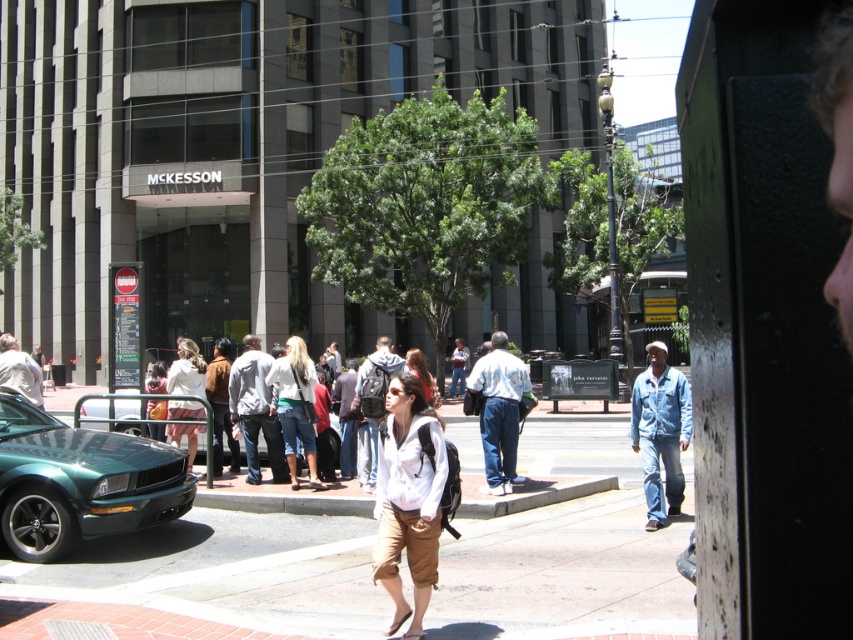
Question: Which object is the closest to the gray cotton hoodie at center?

Choices:
 (A) khaki cotton shorts at center
 (B) matte white shirt at center

Answer: (B)

Question: Considering the relative positions of denim jacket at lower right and matte orange backpack at center in the image provided, where is denim jacket at lower right located with respect to matte orange backpack at center?

Choices:
 (A) left
 (B) right

Answer: (B)

Question: Which object is closer to the camera taking this photo?

Choices:
 (A) khaki cotton shorts at center
 (B) gray cotton hoodie at center
 (C) denim jacket at lower right
 (D) white cotton shirt at center

Answer: (A)

Question: Does white cotton dress at center appear on the right side of matte orange backpack at center?

Choices:
 (A) no
 (B) yes

Answer: (B)

Question: Based on their relative distances, which object is nearer to the light brown leather jacket at center?

Choices:
 (A) green glossy car at lower left
 (B) gray cotton hoodie at center

Answer: (B)

Question: Does green glossy car at lower left appear under matte white shirt at center?

Choices:
 (A) no
 (B) yes

Answer: (B)